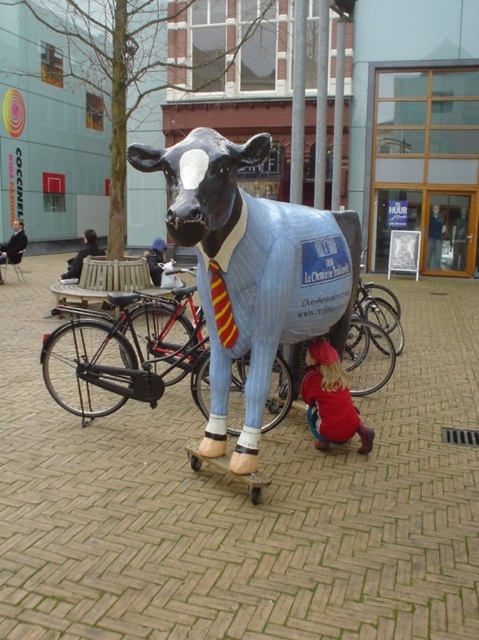
You are standing in the plaza and want to take a photo of both the cow statue and the tree. The cow statue is at point (333, 442) and the tree is at point (11, 241). Since you want both in the frame, which point should you stand closer to ensure both are visible?

You should stand closer to point (333, 442) because it is closer to the viewer than point (11, 241), allowing both points to be in the frame.

You are a photographer setting up a tripod in the plaza. You need to position it so that both the red fabric dress at lower right and the dark blue suit at left are visible in the frame. Given their sizes, which object might require you to adjust your camera angle to ensure it doesn not get cropped out?

The dark blue suit at left occupies more space than the red fabric dress at lower right, so you should ensure the camera angle accommodates its larger size to avoid cropping it out.

You are a tourist visiting the plaza and want to take a photo of the matte blue cow at center and the dark blue suit at left. Which object will appear larger in your photo?

The matte blue cow at center will appear larger in the photo because it is closer to the viewer than the dark blue suit at left.